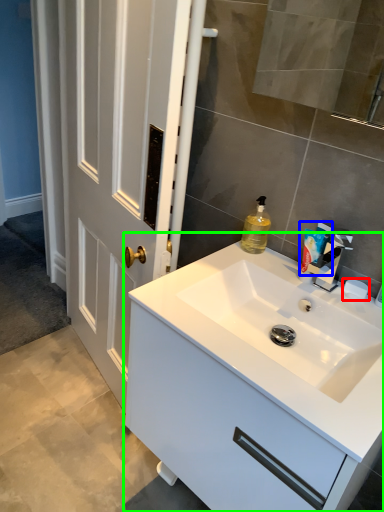
Question: Based on their relative distances, which object is nearer to soap (highlighted by a red box)? Choose from toiletry (highlighted by a blue box) and bathroom cabinet (highlighted by a green box).

Choices:
 (A) toiletry
 (B) bathroom cabinet

Answer: (A)